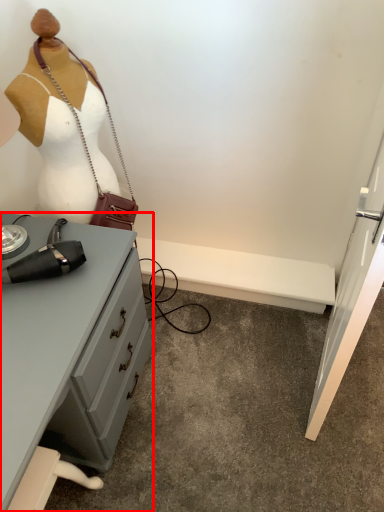
Question: Considering the relative positions of desk (annotated by the red box) and accessory in the image provided, where is desk (annotated by the red box) located with respect to the staircase?

Choices:
 (A) left
 (B) right

Answer: (A)